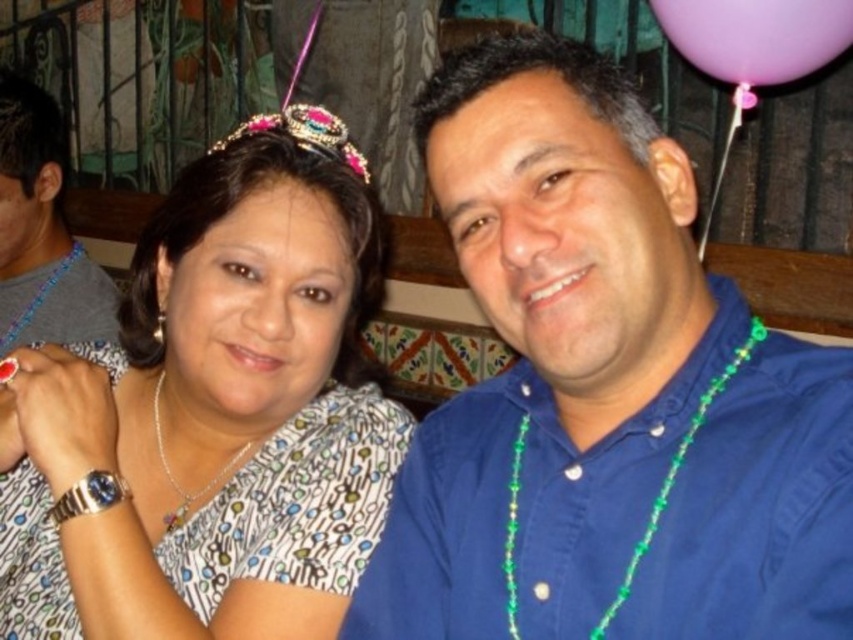
Is blue matte shirt at upper right thinner than green beaded necklace at right?

No, blue matte shirt at upper right is not thinner than green beaded necklace at right.

Which is more to the right, blue matte shirt at upper right or green beaded necklace at right?

green beaded necklace at right is more to the right.

Is point (426, 147) behind point (641, 544)?

Yes, it is.

The height and width of the screenshot is (640, 853). What are the coordinates of `blue matte shirt at upper right` in the screenshot? It's located at (605, 392).

Does blue matte shirt at upper right come behind purple latex balloon at upper right?

No.

At what (x,y) coordinates should I click in order to perform the action: click on blue matte shirt at upper right. Please return your answer as a coordinate pair (x, y). Looking at the image, I should click on (605, 392).

At what (x,y) coordinates should I click in order to perform the action: click on blue matte shirt at upper right. Please return your answer as a coordinate pair (x, y). Looking at the image, I should click on (605, 392).

Locate an element on the screen. blue matte shirt at upper right is located at coordinates (605, 392).

Is blue matte shirt at upper right closer to camera compared to sparkly pink and blue tiara at upper center?

Yes, it is.

From the picture: Does blue matte shirt at upper right have a greater width compared to sparkly pink and blue tiara at upper center?

Yes, blue matte shirt at upper right is wider than sparkly pink and blue tiara at upper center.

You are a GUI agent. You are given a task and a screenshot of the screen. Output one action in this format:
    pyautogui.click(x=<x>, y=<y>)
    Task: Click on the blue matte shirt at upper right
    
    Given the screenshot: What is the action you would take?
    pyautogui.click(x=605, y=392)

Locate an element on the screen. This screenshot has width=853, height=640. blue matte shirt at upper right is located at coordinates (605, 392).